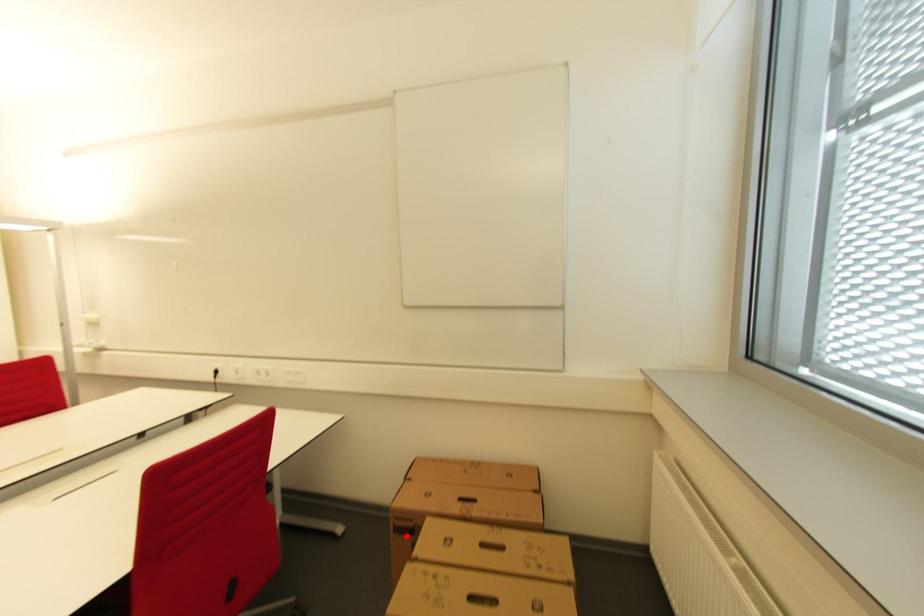
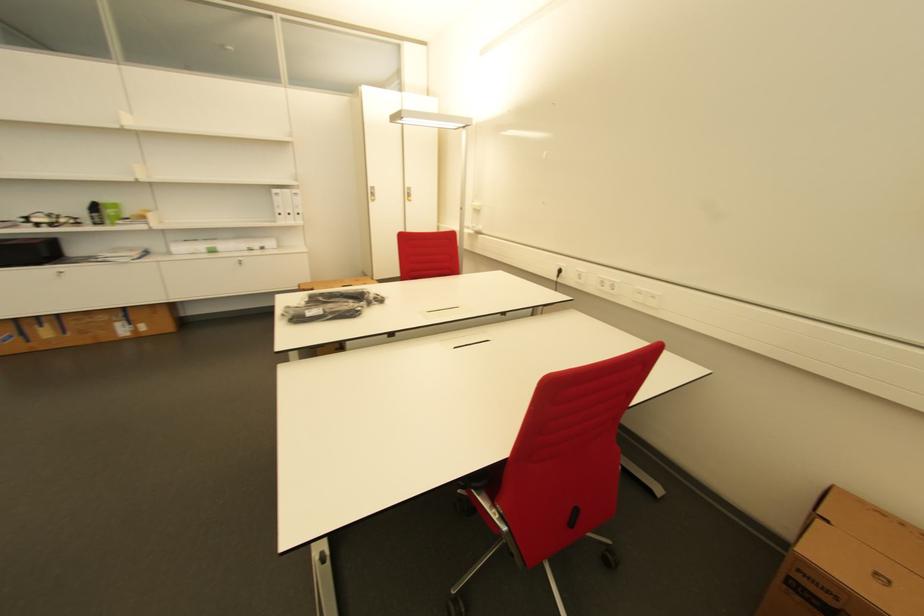
Question: A red point is marked in image1. In image2, is the corresponding 3D point closer to the camera or farther? Reply with the corresponding letter.

Choices:
 (A) The corresponding 3D point is closer.
 (B) The corresponding 3D point is farther.

Answer: (B)